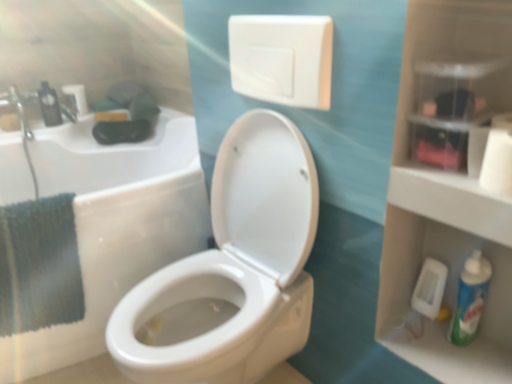
Question: In the image, is white matte toilet paper at upper left, positioned as the 1th toilet paper in back-to-front order, positioned in front of or behind teal fabric towel at left?

Choices:
 (A) front
 (B) behind

Answer: (B)

Question: From a real-world perspective, is white matte toilet paper at upper left, placed as the 2th toilet paper when sorted from left to right, above or below teal fabric towel at left?

Choices:
 (A) above
 (B) below

Answer: (A)

Question: Based on their relative distances, which object is farther from the white glossy toilet at center?

Choices:
 (A) white matte toilet paper at upper right, arranged as the 1th toilet paper when viewed from the front
 (B) black plastic mouthwash at left, the 2th mouthwash from the bottom
 (C) white matte toilet paper at left, positioned as the 2th toilet paper in bottom-to-top order
 (D) white matte toilet paper at upper left, the first toilet paper from the top
 (E) white glossy toilet at center

Answer: (D)

Question: Considering the real-world distances, which object is closest to the black plastic mouthwash at left, the 2th mouthwash positioned from the right?

Choices:
 (A) white matte toilet paper at upper left, the first toilet paper from the top
 (B) white glossy toilet at center
 (C) white matte toilet paper at left, the second toilet paper in the front-to-back sequence
 (D) white matte toilet paper at upper right, which is the 3th toilet paper in left-to-right order
 (E) white glossy toilet at center

Answer: (A)